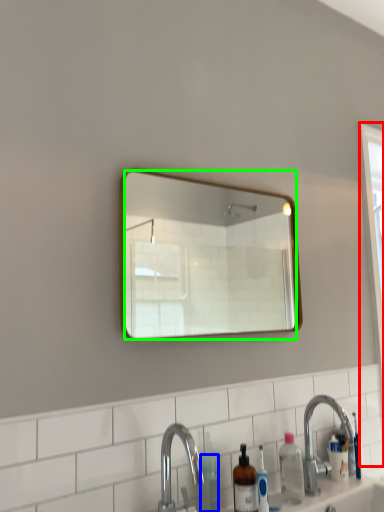
Question: Based on their relative distances, which object is farther from screen door (highlighted by a red box)? Choose from toiletry (highlighted by a blue box) and mirror (highlighted by a green box).

Choices:
 (A) toiletry
 (B) mirror

Answer: (B)